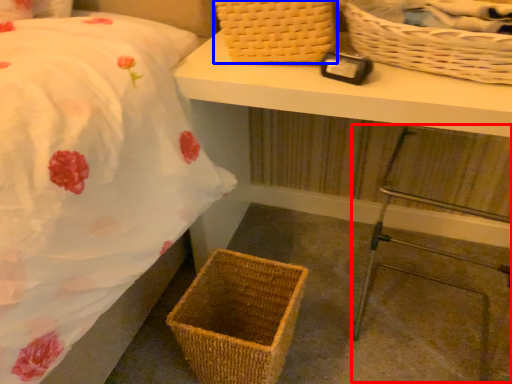
Question: Which object appears closest to the camera in this image, step stool (highlighted by a red box) or picnic basket (highlighted by a blue box)?

Choices:
 (A) step stool
 (B) picnic basket

Answer: (A)